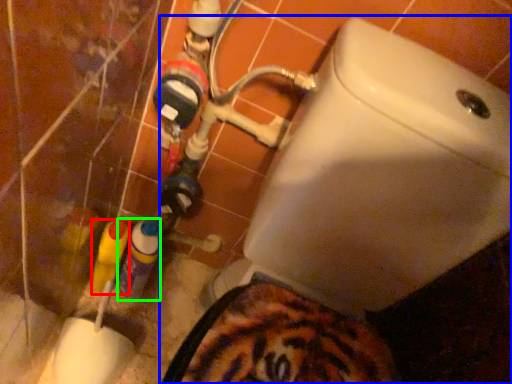
Question: Which object is the closest to the bottle (highlighted by a red box)? Choose among these: toilet (highlighted by a blue box) or bottle (highlighted by a green box).

Choices:
 (A) toilet
 (B) bottle

Answer: (B)